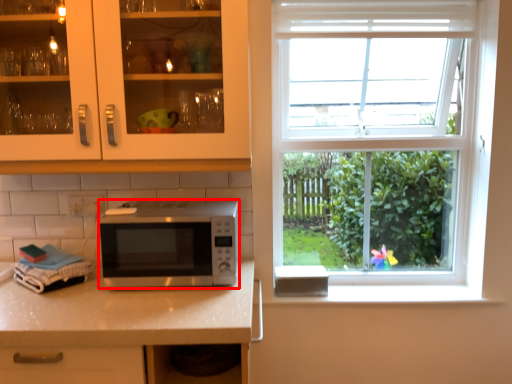
Question: From the image, what is the correct spatial relationship of microwave oven (annotated by the red box) in relation to cabinetry?

Choices:
 (A) left
 (B) right

Answer: (B)